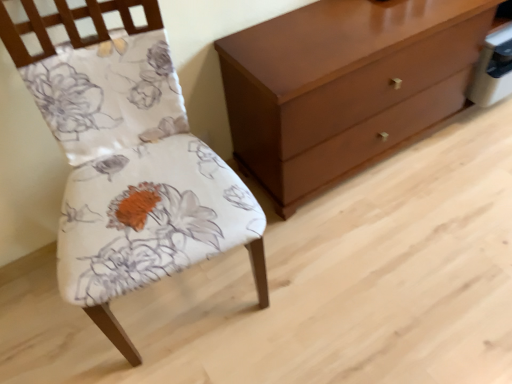
Question: Considering the positions of matte brown chest of drawers at right and floral fabric chair at left in the image, is matte brown chest of drawers at right bigger or smaller than floral fabric chair at left?

Choices:
 (A) big
 (B) small

Answer: (A)

Question: Is point (317, 81) closer or farther from the camera than point (58, 23)?

Choices:
 (A) farther
 (B) closer

Answer: (A)

Question: In the image, is matte brown chest of drawers at right positioned in front of or behind floral fabric chair at left?

Choices:
 (A) front
 (B) behind

Answer: (B)

Question: From the image's perspective, is floral fabric chair at left positioned above or below matte brown chest of drawers at right?

Choices:
 (A) below
 (B) above

Answer: (A)

Question: Is floral fabric chair at left situated inside matte brown chest of drawers at right or outside?

Choices:
 (A) outside
 (B) inside

Answer: (A)

Question: Is point (11, 41) closer or farther from the camera than point (369, 84)?

Choices:
 (A) farther
 (B) closer

Answer: (B)

Question: Considering the positions of floral fabric chair at left and matte brown chest of drawers at right in the image, is floral fabric chair at left taller or shorter than matte brown chest of drawers at right?

Choices:
 (A) short
 (B) tall

Answer: (B)